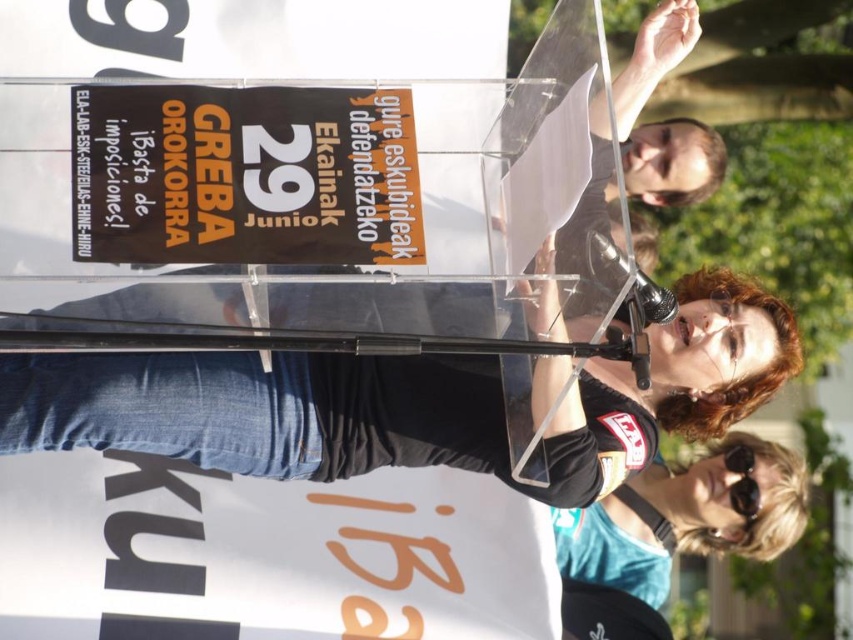
You are an event photographer at the public speaking event. You notice the black paper sign at upper center and the black plastic sunglasses at lower right in your camera viewfinder. Which object is positioned to the right side in the frame?

The black plastic sunglasses at lower right are positioned to the right side in the frame because the black paper sign at upper center is to the left of them.

You are a photographer at the event and want to capture the speaker and the banner. The point at coordinates point (242,176) is part of an important element in the scene. Which object is this point located on?

The point (242,176) is on the black paper sign at upper center.